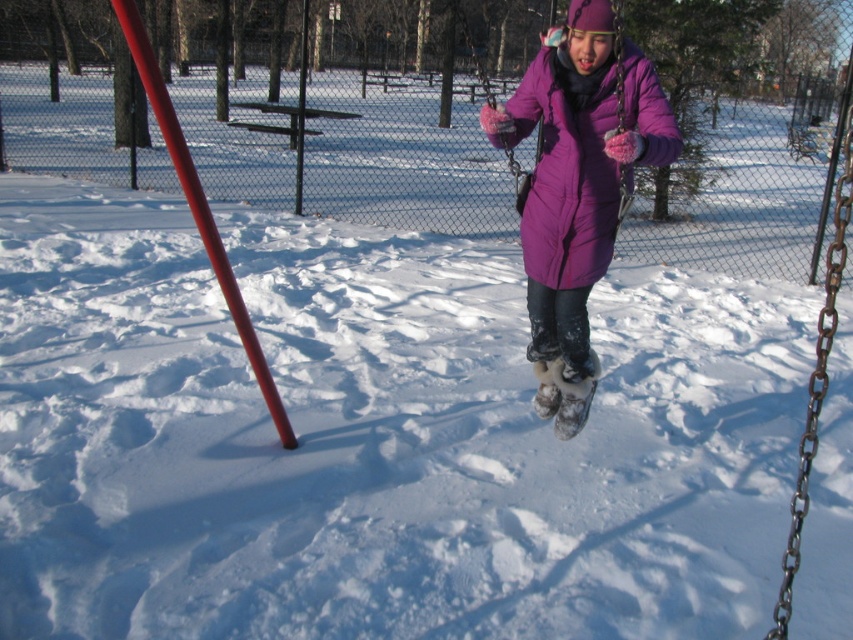
What is the spatial relationship between the purple down jacket at center and the smooth glossy pole at left in the winter playground scene?

The purple down jacket at center is positioned to the right of the smooth glossy pole at left.